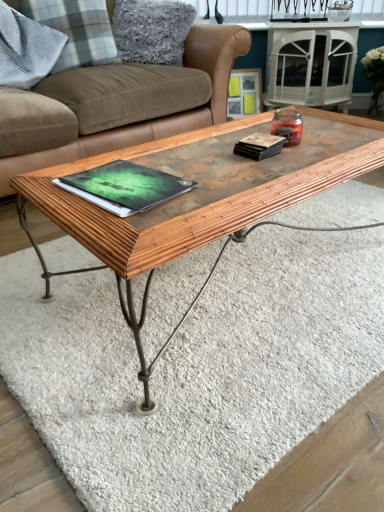
Question: Is the position of matte black book at upper right, which is counted as the first book, starting from the right, less distant than that of wooden textured coffee table at center?

Choices:
 (A) yes
 (B) no

Answer: (B)

Question: Is matte black book at upper right, which is counted as the first book, starting from the right, touching wooden textured coffee table at center?

Choices:
 (A) yes
 (B) no

Answer: (B)

Question: Considering the relative sizes of matte black book at upper right, acting as the first book starting from the top, and wooden textured coffee table at center in the image provided, is matte black book at upper right, acting as the first book starting from the top, bigger than wooden textured coffee table at center?

Choices:
 (A) yes
 (B) no

Answer: (B)

Question: From the image's perspective, is matte black book at upper right, which is the 2th book in bottom-to-top order, below wooden textured coffee table at center?

Choices:
 (A) yes
 (B) no

Answer: (B)

Question: Can you confirm if matte black book at upper right, acting as the second book starting from the left, is positioned to the right of wooden textured coffee table at center?

Choices:
 (A) yes
 (B) no

Answer: (A)

Question: From the image's perspective, relative to gray plaid pillow at upper left, which is the 3th pillow in right-to-left order, is green matte book at center, acting as the first book starting from the left, above or below?

Choices:
 (A) above
 (B) below

Answer: (B)

Question: From a real-world perspective, is green matte book at center, acting as the first book starting from the left, positioned above or below gray plaid pillow at upper left, positioned as the first pillow in left-to-right order?

Choices:
 (A) above
 (B) below

Answer: (B)

Question: In the image, is green matte book at center, placed as the 2th book when sorted from right to left, on the left side or the right side of gray plaid pillow at upper left, which is the 3th pillow in right-to-left order?

Choices:
 (A) right
 (B) left

Answer: (A)

Question: Based on their sizes in the image, would you say green matte book at center, arranged as the first book when ordered from the bottom, is bigger or smaller than gray plaid pillow at upper left, which is the 3th pillow in right-to-left order?

Choices:
 (A) small
 (B) big

Answer: (A)

Question: Based on their positions, is green matte book at center, which appears as the 2th book when viewed from the top, located to the left or right of wooden picture frame at upper center?

Choices:
 (A) right
 (B) left

Answer: (B)

Question: From their relative heights in the image, would you say green matte book at center, which appears as the 2th book when viewed from the top, is taller or shorter than wooden picture frame at upper center?

Choices:
 (A) short
 (B) tall

Answer: (A)

Question: From the image's perspective, relative to wooden picture frame at upper center, is green matte book at center, acting as the first book starting from the left, above or below?

Choices:
 (A) above
 (B) below

Answer: (B)

Question: From a real-world perspective, is green matte book at center, acting as the first book starting from the left, physically located above or below wooden picture frame at upper center?

Choices:
 (A) above
 (B) below

Answer: (A)

Question: From a real-world perspective, relative to matte black book at upper right, acting as the first book starting from the top, is gray plaid pillow at upper left, the second pillow when ordered from right to left, vertically above or below?

Choices:
 (A) below
 (B) above

Answer: (B)

Question: Is gray plaid pillow at upper left, the second pillow when ordered from right to left, to the left or to the right of matte black book at upper right, acting as the second book starting from the left, in the image?

Choices:
 (A) left
 (B) right

Answer: (A)